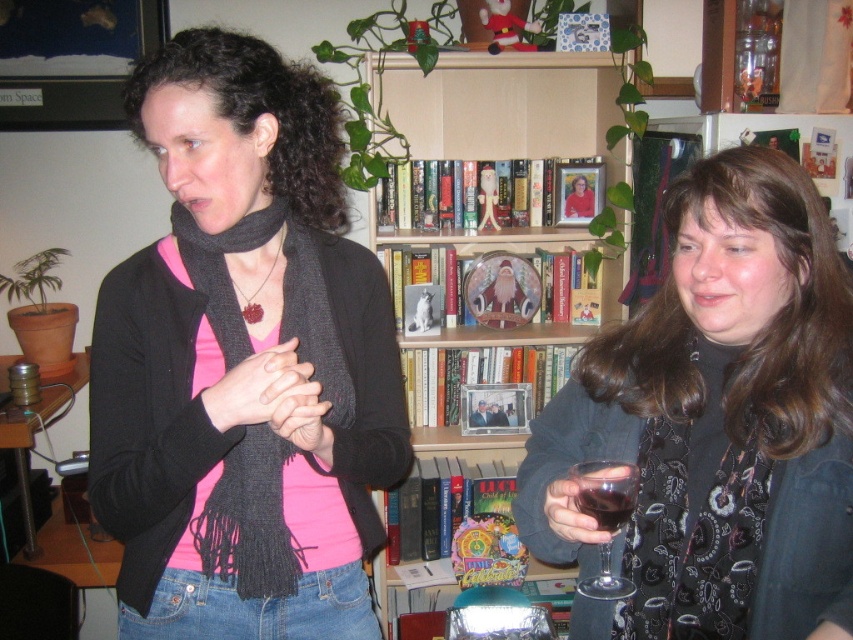
You are a bartender preparing drinks for two guests. The first guest wants a drink in a transparent glass wine glass at lower right, and the second guest prefers a dark glass at right. If you need to place both glasses on a narrow shelf that can only accommodate one glass at a time, which glass would you choose to place first based on their sizes?

The transparent glass wine glass at lower right has a larger width than the dark glass at right. Since the shelf can only hold one glass at a time, you should place the transparent glass wine glass at lower right first to ensure it fits properly before the narrower dark glass at right.

You are organizing a small party and want to ensure there is enough space between the matte black scarf at center and the matte black jacket at right for guests to pass comfortably. According to the scene, which direction should you place the jacket relative to the scarf to maintain this spacing?

The matte black jacket at right is already positioned to the right of the matte black scarf at center, so maintaining this arrangement ensures there is space between them for guests to pass comfortably.

You are organizing a small gathering and need to place a new decorative item between the matte black jacket at right and the smooth wooden frame at center. Considering their sizes, which object should the new item be placed closer to?

The matte black jacket at right is bigger than the smooth wooden frame at center, so the new decorative item should be placed closer to the smooth wooden frame at center to balance the arrangement.